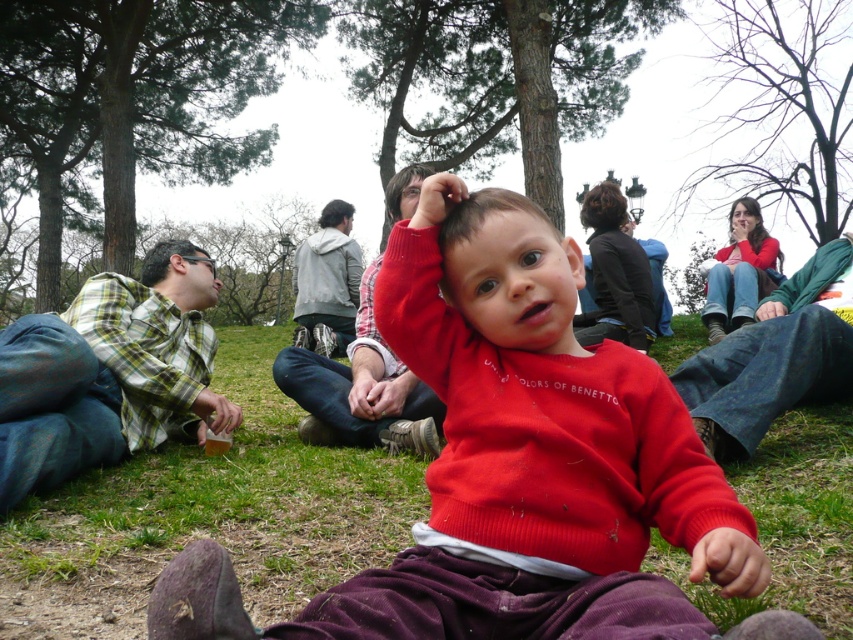
Does green plaid shirt at left come behind plaid fabric shirt at center?

Yes, it is.

The image size is (853, 640). What do you see at coordinates (105, 372) in the screenshot? I see `green plaid shirt at left` at bounding box center [105, 372].

At what (x,y) coordinates should I click in order to perform the action: click on green plaid shirt at left. Please return your answer as a coordinate pair (x, y). This screenshot has width=853, height=640. Looking at the image, I should click on (105, 372).

Does green grass at center appear on the right side of green plaid shirt at left?

Indeed, green grass at center is positioned on the right side of green plaid shirt at left.

Who is more forward, (331, 528) or (115, 452)?

Positioned in front is point (331, 528).

Image resolution: width=853 pixels, height=640 pixels. I want to click on green grass at center, so click(x=207, y=515).

Identify the location of green grass at center. (207, 515).

Who is shorter, plaid fabric shirt at center or gray fabric jacket at center?

Standing shorter between the two is plaid fabric shirt at center.

Identify the location of plaid fabric shirt at center. The width and height of the screenshot is (853, 640). (361, 390).

Where is `plaid fabric shirt at center`? The image size is (853, 640). plaid fabric shirt at center is located at coordinates (361, 390).